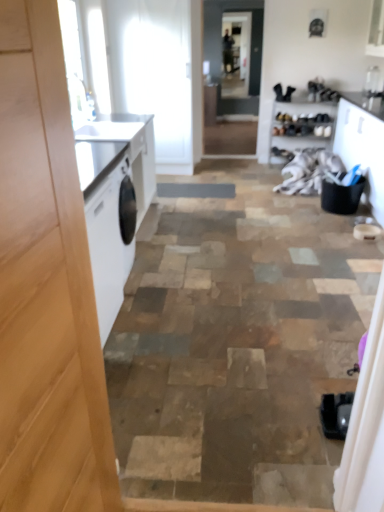
Question: Which is correct: clear glass screen door at center, arranged as the 1th screen door when viewed from the top, is inside wooden shoe rack at upper right, or outside of it?

Choices:
 (A) outside
 (B) inside

Answer: (A)

Question: From a real-world perspective, is clear glass screen door at center, which is the 2th screen door from front to back, above or below wooden shoe rack at upper right?

Choices:
 (A) above
 (B) below

Answer: (A)

Question: Which object is the farthest from the clear glass screen door at center, which ranks as the first screen door in front-to-back order?

Choices:
 (A) clear glass screen door at center, arranged as the 1th screen door when viewed from the top
 (B) wooden shoe rack at upper right
 (C) white fabric at center

Answer: (C)

Question: Considering the real-world distances, which object is farthest from the clear glass screen door at center, which ranks as the 2th screen door in bottom-to-top order?

Choices:
 (A) clear glass screen door at center, acting as the 2th screen door starting from the top
 (B) white fabric at center
 (C) wooden shoe rack at upper right

Answer: (B)